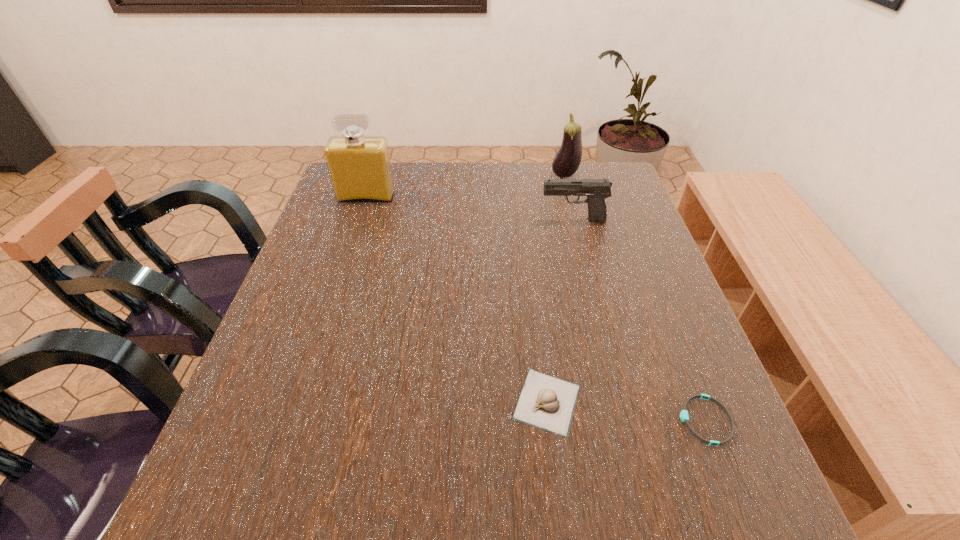
Find the location of a particular element. vacant area at the near left corner is located at coordinates (251, 487).

The image size is (960, 540). I want to click on vacant space at the near right corner, so click(x=747, y=523).

At what (x,y) coordinates should I click in order to perform the action: click on vacant space that is in between the leftmost object and the third nearest object. Please return your answer as a coordinate pair (x, y). The width and height of the screenshot is (960, 540). Looking at the image, I should click on (469, 209).

In order to click on free area in between the leftmost object and the garlic in this screenshot , I will do `click(457, 300)`.

You are a GUI agent. You are given a task and a screenshot of the screen. Output one action in this format:
    pyautogui.click(x=<x>, y=<y>)
    Task: Click on the unoccupied position between the eggplant and the garlic
    This screenshot has height=540, width=960.
    Given the screenshot: What is the action you would take?
    pyautogui.click(x=556, y=289)

In order to click on vacant space that's between the third farthest object and the fourth tallest object in this screenshot , I will do `click(560, 311)`.

Locate an element on the screen. The height and width of the screenshot is (540, 960). free spot between the third tallest object and the leftmost object is located at coordinates (469, 209).

At what (x,y) coordinates should I click in order to perform the action: click on free space that is in between the eggplant and the pistol. Please return your answer as a coordinate pair (x, y). The height and width of the screenshot is (540, 960). Looking at the image, I should click on (568, 198).

Identify the location of blank region between the farthest object and the second shortest object. The width and height of the screenshot is (960, 540). (556, 289).

Find the location of a particular element. The image size is (960, 540). vacant area between the second farthest object and the wristband is located at coordinates (536, 309).